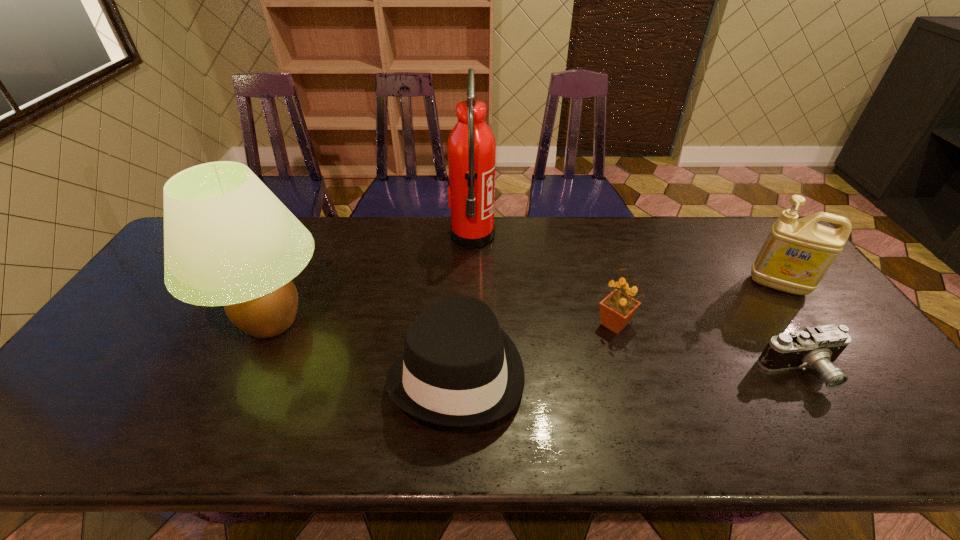
Where is `blank space located at the front of the sunflower with flowers visible`? blank space located at the front of the sunflower with flowers visible is located at coordinates (639, 407).

Where is `vacant space located 0.180m on the back of the fedora`? vacant space located 0.180m on the back of the fedora is located at coordinates (462, 274).

Identify the location of vacant space located at the lens of the shortest object. The image size is (960, 540). (837, 426).

Where is `object located at the far edge`? object located at the far edge is located at coordinates (471, 147).

Where is `object present at the near edge`? The height and width of the screenshot is (540, 960). object present at the near edge is located at coordinates (459, 369).

Image resolution: width=960 pixels, height=540 pixels. In order to click on detergent positioned at the right edge in this screenshot , I will do `click(797, 253)`.

Locate an element on the screen. camera that is at the right edge is located at coordinates (818, 347).

You are a GUI agent. You are given a task and a screenshot of the screen. Output one action in this format:
    pyautogui.click(x=<x>, y=<y>)
    Task: Click on the vacant area at the far edge
    This screenshot has height=540, width=960.
    Given the screenshot: What is the action you would take?
    pyautogui.click(x=419, y=226)

Identify the location of vacant area at the near edge. Image resolution: width=960 pixels, height=540 pixels. (567, 422).

Image resolution: width=960 pixels, height=540 pixels. I want to click on blank space at the left edge of the desktop, so click(x=121, y=314).